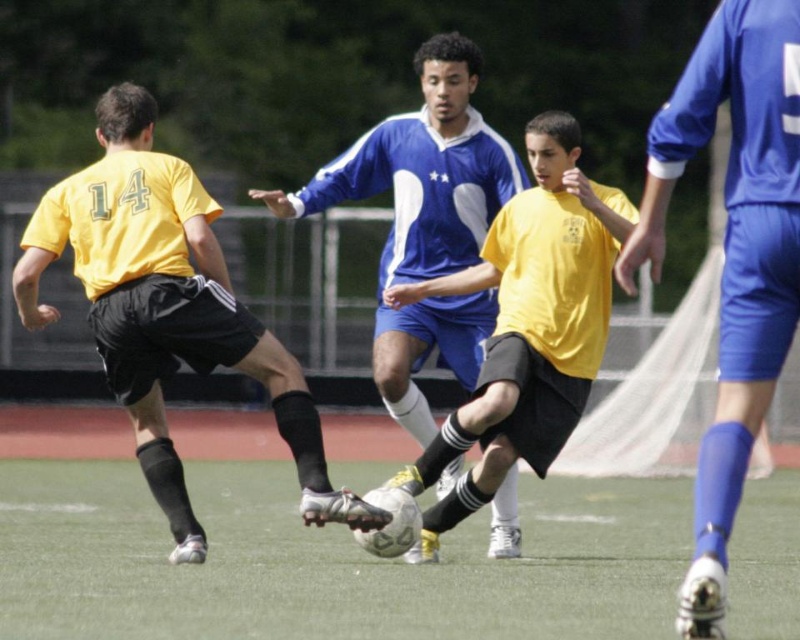
What is the exact coordinate of the green artificial turf at center?

The green artificial turf at center is located at coordinate point (326,561).